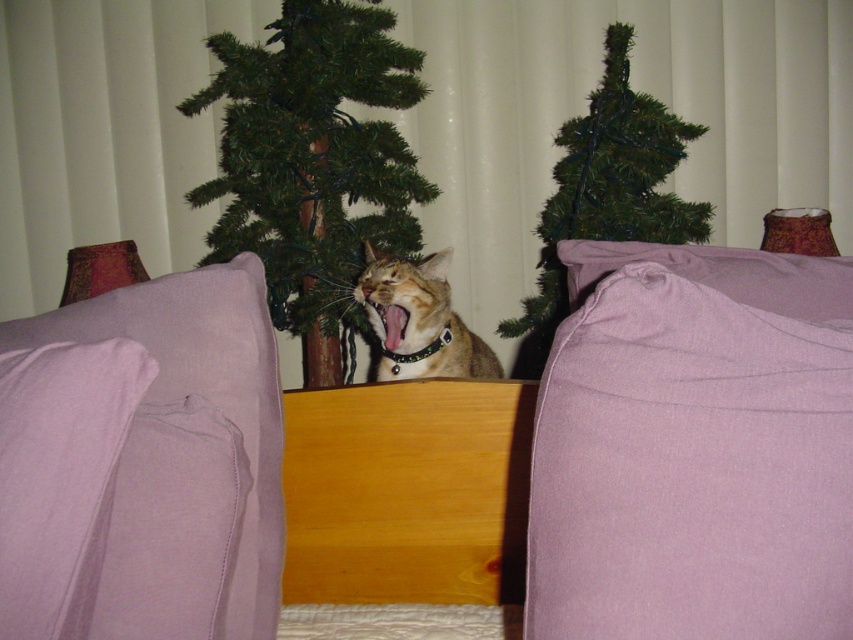
Question: Where is purple fabric pillow at left located in relation to black glossy mouth at center in the image?

Choices:
 (A) right
 (B) left

Answer: (B)

Question: Considering the real-world distances, which object is closest to the tabby fur cat at center?

Choices:
 (A) purple fabric pillow at left
 (B) purple fabric bed at center
 (C) lavender fleece pillow at lower left

Answer: (B)

Question: Which object appears farthest from the camera in this image?

Choices:
 (A) purple fabric pillow at left
 (B) green artificial tree at upper center
 (C) black glossy mouth at center

Answer: (B)

Question: In this image, where is lavender cotton blanket at lower right located relative to green artificial tree at upper center?

Choices:
 (A) left
 (B) right

Answer: (B)

Question: Which of the following is the farthest from the observer?

Choices:
 (A) purple fabric pillow at left
 (B) tabby fur cat at center

Answer: (B)

Question: Does green artificial tree at upper center appear under lavender fleece pillow at lower left?

Choices:
 (A) no
 (B) yes

Answer: (A)